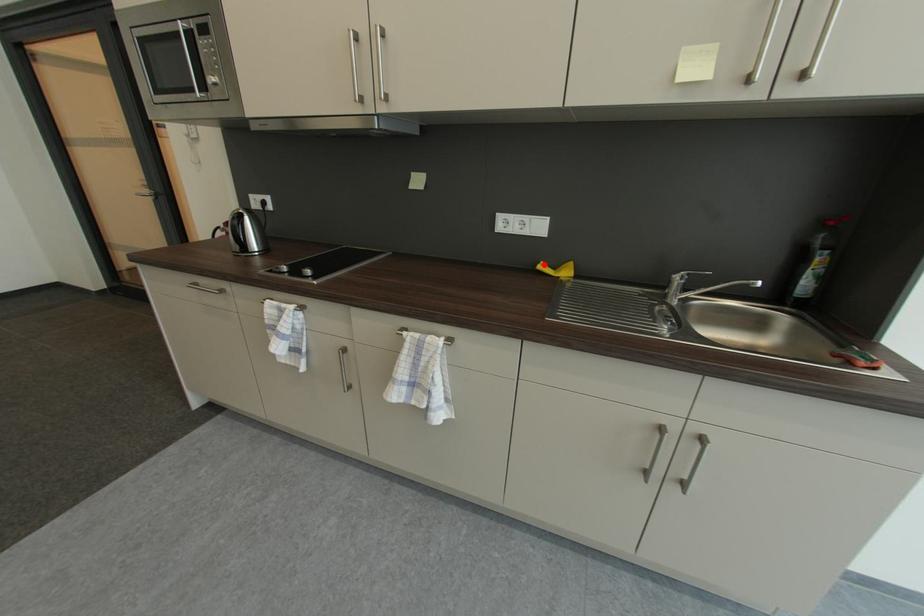
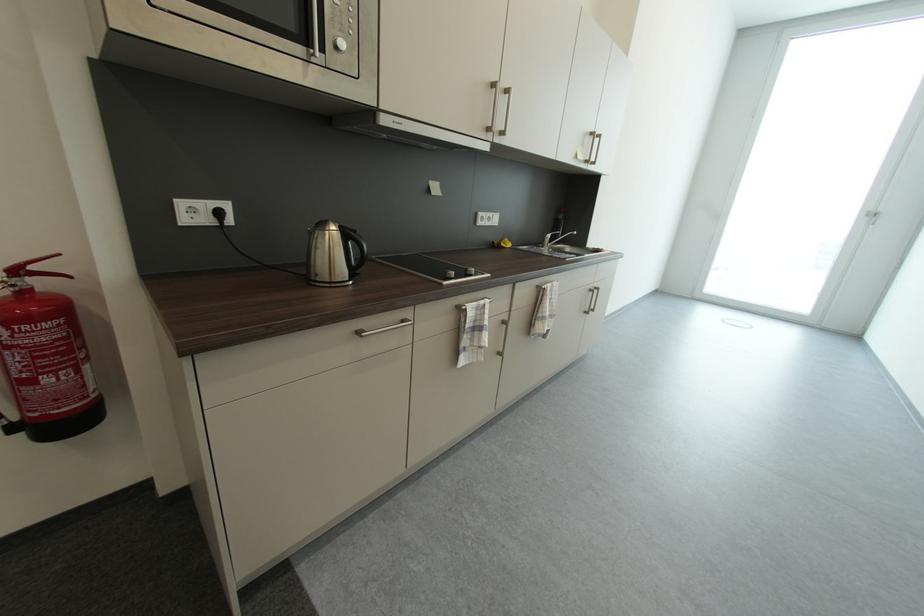
Find the pixel in the second image that matches the highlighted location in the first image.

(501, 244)